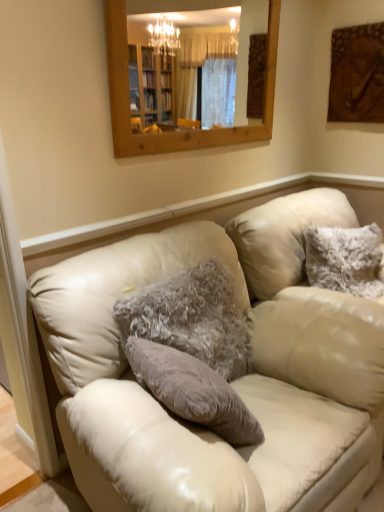
Question: Can you confirm if leather couch at center is positioned to the right of wooden textured painting at upper right?

Choices:
 (A) no
 (B) yes

Answer: (A)

Question: From a real-world perspective, is leather couch at center positioned over wooden textured painting at upper right based on gravity?

Choices:
 (A) yes
 (B) no

Answer: (B)

Question: Is the position of leather couch at center less distant than that of wooden textured painting at upper right?

Choices:
 (A) yes
 (B) no

Answer: (A)

Question: Can we say leather couch at center lies outside wooden textured painting at upper right?

Choices:
 (A) yes
 (B) no

Answer: (A)

Question: From the image's perspective, is leather couch at center on wooden textured painting at upper right?

Choices:
 (A) yes
 (B) no

Answer: (B)

Question: Considering their positions, is fuzzy gray pillow at center, which is the 2th pillow from right to left, located in front of or behind fuzzy white pillow at upper right, positioned as the 1th pillow in right-to-left order?

Choices:
 (A) front
 (B) behind

Answer: (A)

Question: Would you say fuzzy gray pillow at center, which is counted as the 1th pillow, starting from the front, is inside or outside fuzzy white pillow at upper right, the 1th pillow positioned from the back?

Choices:
 (A) outside
 (B) inside

Answer: (A)

Question: From a real-world perspective, relative to fuzzy white pillow at upper right, acting as the 2th pillow starting from the left, is fuzzy gray pillow at center, which is the 2th pillow from right to left, vertically above or below?

Choices:
 (A) above
 (B) below

Answer: (B)

Question: Would you say fuzzy gray pillow at center, which is counted as the 1th pillow, starting from the front, is to the left or to the right of fuzzy white pillow at upper right, the second pillow viewed from the front, in the picture?

Choices:
 (A) right
 (B) left

Answer: (B)

Question: Does point (168, 13) appear closer or farther from the camera than point (372, 58)?

Choices:
 (A) farther
 (B) closer

Answer: (A)

Question: From the image's perspective, is wooden frame mirror at upper center positioned above or below wooden textured painting at upper right?

Choices:
 (A) below
 (B) above

Answer: (A)

Question: In terms of height, does wooden frame mirror at upper center look taller or shorter compared to wooden textured painting at upper right?

Choices:
 (A) tall
 (B) short

Answer: (A)

Question: Would you say wooden frame mirror at upper center is to the left or to the right of wooden textured painting at upper right in the picture?

Choices:
 (A) right
 (B) left

Answer: (B)

Question: From their relative heights in the image, would you say wooden textured painting at upper right is taller or shorter than fuzzy gray pillow at center, the 2th pillow when ordered from back to front?

Choices:
 (A) tall
 (B) short

Answer: (A)

Question: Which is correct: wooden textured painting at upper right is inside fuzzy gray pillow at center, the 2th pillow when ordered from back to front, or outside of it?

Choices:
 (A) outside
 (B) inside

Answer: (A)